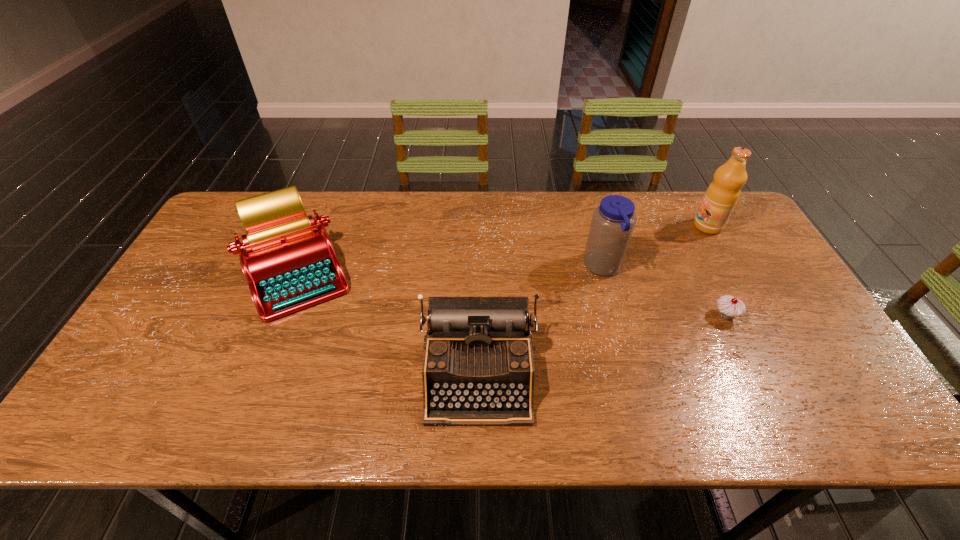
What are the coordinates of `object that is positioned at the near edge` in the screenshot? It's located at (478, 368).

Locate an element on the screen. The height and width of the screenshot is (540, 960). object situated at the left edge is located at coordinates (289, 265).

Locate an element on the screen. This screenshot has width=960, height=540. object that is at the right edge is located at coordinates (721, 196).

I want to click on object located at the far left corner, so click(x=289, y=265).

You are a GUI agent. You are given a task and a screenshot of the screen. Output one action in this format:
    pyautogui.click(x=<x>, y=<y>)
    Task: Click on the object situated at the far right corner
    The image size is (960, 540).
    Given the screenshot: What is the action you would take?
    point(721,196)

In the image, there is a desktop. At what (x,y) coordinates should I click in order to perform the action: click on vacant space at the far edge. Please return your answer as a coordinate pair (x, y). This screenshot has height=540, width=960. Looking at the image, I should click on [x=348, y=231].

Identify the location of vacant space at the near edge of the desktop. The height and width of the screenshot is (540, 960). (650, 407).

The width and height of the screenshot is (960, 540). In the image, there is a desktop. What are the coordinates of `vacant space at the left edge` in the screenshot? It's located at (192, 313).

Image resolution: width=960 pixels, height=540 pixels. In order to click on vacant region at the right edge of the desktop in this screenshot , I will do `click(775, 333)`.

Locate an element on the screen. vacant space at the far left corner of the desktop is located at coordinates (238, 227).